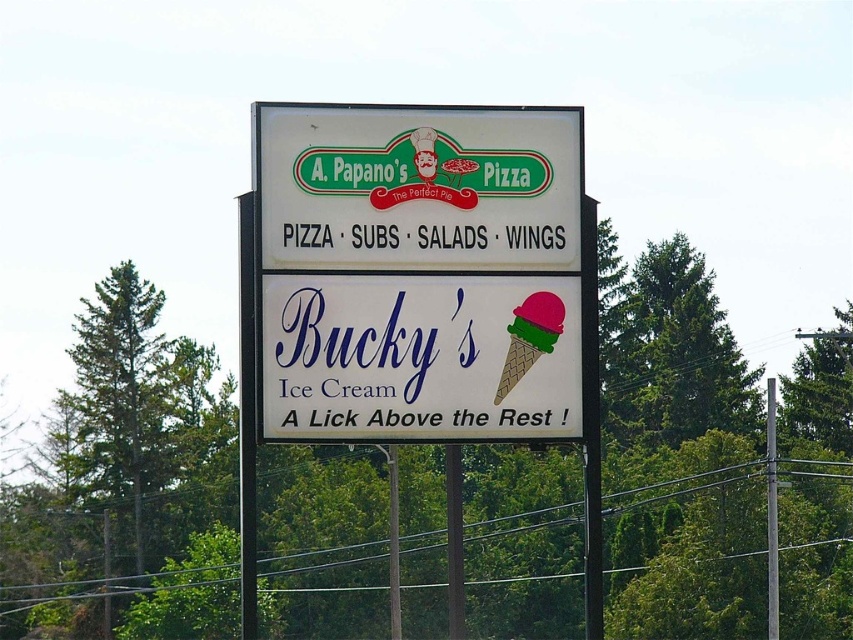
Identify the location of white plastic sign at center. This screenshot has width=853, height=640. (418, 186).

Does point (546, 212) come closer to viewer compared to point (521, 364)?

No, it is not.

Between point (276, 195) and point (508, 355), which one is positioned in front?

Positioned in front is point (276, 195).

I want to click on white plastic sign at center, so click(418, 186).

Is white paper sign at center above green matte ice cream cone at center?

Incorrect, white paper sign at center is not positioned above green matte ice cream cone at center.

Is point (502, 349) farther from viewer compared to point (540, 330)?

No, it is in front of (540, 330).

In order to click on white paper sign at center in this screenshot , I will do `click(421, 358)`.

How much distance is there between white paper sign at center and white plastic sign at center?

They are 2.23 meters apart.

Consider the image. Who is positioned more to the right, white paper sign at center or white plastic sign at center?

white plastic sign at center is more to the right.

Does point (412, 337) lie behind point (476, 262)?

No, it is not.

This screenshot has width=853, height=640. In order to click on white paper sign at center in this screenshot , I will do `click(421, 358)`.